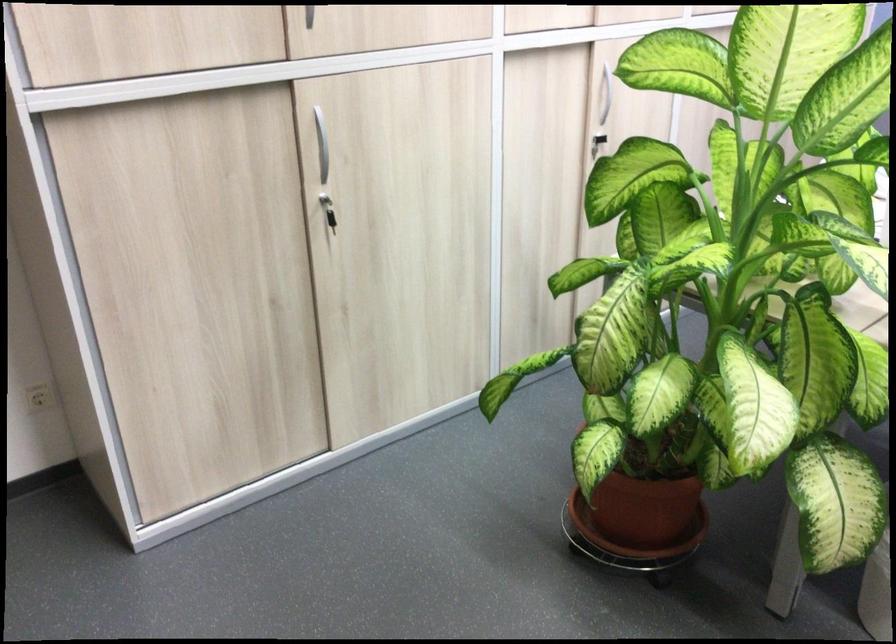
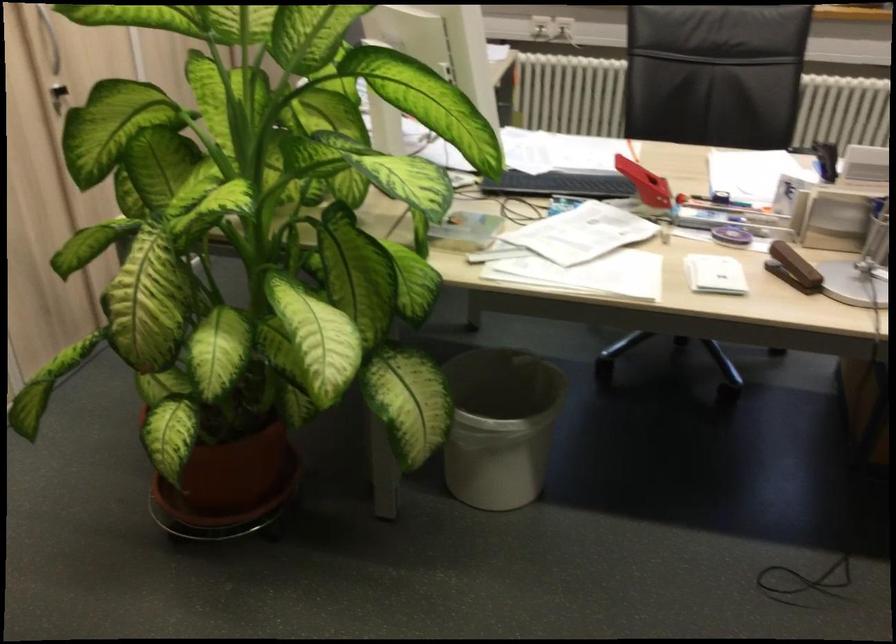
Question: The images are taken continuously from a first-person perspective. In which direction is your viewpoint rotating?

Choices:
 (A) Left
 (B) Right
 (C) Up
 (D) Down

Answer: (B)